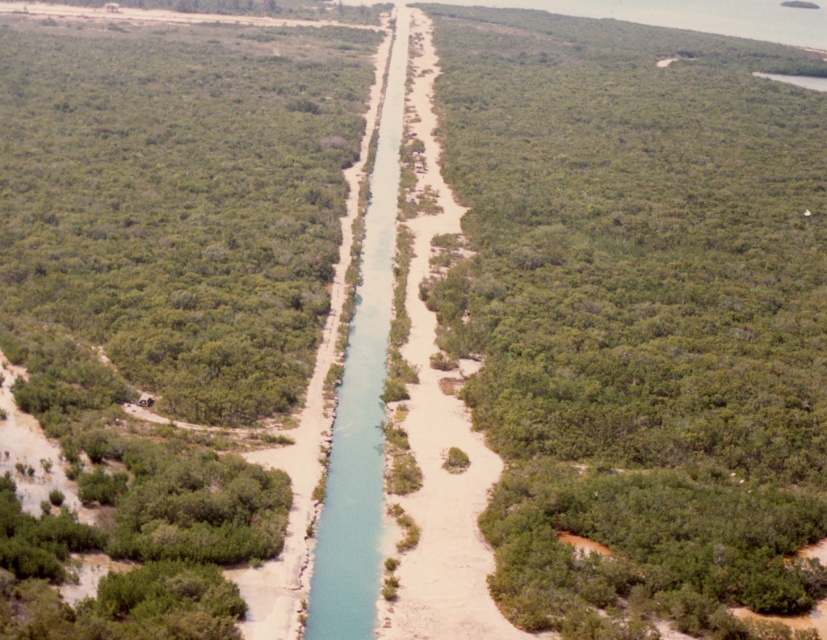
Between green leafy vegetation at center and green leafy shrubs at center, which one is positioned higher?

Positioned higher is green leafy vegetation at center.

Consider the image. Is green leafy vegetation at center bigger than green leafy shrubs at center?

Yes, green leafy vegetation at center is bigger than green leafy shrubs at center.

Who is more forward, (493, 161) or (93, 301)?

Positioned in front is point (93, 301).

Find the location of a particular element. The height and width of the screenshot is (640, 827). green leafy vegetation at center is located at coordinates (638, 316).

Who is more distant from viewer, (x=8, y=252) or (x=313, y=618)?

Point (x=8, y=252)

What do you see at coordinates (165, 291) in the screenshot?
I see `green leafy shrubs at center` at bounding box center [165, 291].

Locate an element on the screen. The height and width of the screenshot is (640, 827). green leafy shrubs at center is located at coordinates (x=165, y=291).

Which is more to the left, green leafy vegetation at center or blue smooth waterway at center?

blue smooth waterway at center is more to the left.

Locate an element on the screen. green leafy vegetation at center is located at coordinates (638, 316).

Image resolution: width=827 pixels, height=640 pixels. Describe the element at coordinates (638, 316) in the screenshot. I see `green leafy vegetation at center` at that location.

Locate an element on the screen. This screenshot has height=640, width=827. green leafy vegetation at center is located at coordinates (638, 316).